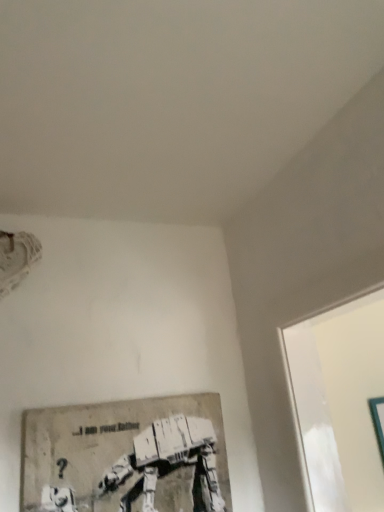
In order to click on teal glossy picture frame at right, which appears as the 1th picture frame when viewed from the back in this screenshot , I will do `click(378, 421)`.

What do you see at coordinates (378, 421) in the screenshot?
I see `teal glossy picture frame at right, arranged as the second picture frame when viewed from the left` at bounding box center [378, 421].

What do you see at coordinates (126, 457) in the screenshot?
I see `matte gray poster at lower left, acting as the 2th picture frame starting from the right` at bounding box center [126, 457].

Where is `matte gray poster at lower left, positioned as the second picture frame in back-to-front order`? This screenshot has height=512, width=384. matte gray poster at lower left, positioned as the second picture frame in back-to-front order is located at coordinates pyautogui.click(x=126, y=457).

Find the location of a particular element. The height and width of the screenshot is (512, 384). teal glossy picture frame at right, the second picture frame viewed from the front is located at coordinates (378, 421).

Visually, is teal glossy picture frame at right, arranged as the second picture frame when viewed from the left, positioned to the left or to the right of matte gray poster at lower left, which is counted as the first picture frame, starting from the front?

teal glossy picture frame at right, arranged as the second picture frame when viewed from the left, is positioned on matte gray poster at lower left, which is counted as the first picture frame, starting from the front,'s right side.

Is teal glossy picture frame at right, arranged as the second picture frame when viewed from the left, in front of or behind matte gray poster at lower left, which ranks as the first picture frame in left-to-right order, in the image?

In the image, teal glossy picture frame at right, arranged as the second picture frame when viewed from the left, appears behind matte gray poster at lower left, which ranks as the first picture frame in left-to-right order.

Which point is more distant from viewer, (382, 433) or (71, 426)?

The point (382, 433) is more distant.

From the image's perspective, between teal glossy picture frame at right, the second picture frame viewed from the front, and matte gray poster at lower left, positioned as the second picture frame in back-to-front order, which one is located above?

matte gray poster at lower left, positioned as the second picture frame in back-to-front order, is shown above in the image.

From a real-world perspective, which object stands above the other?

In real-world perspective, matte gray poster at lower left, acting as the 2th picture frame starting from the right, is above.

Which object is wider, teal glossy picture frame at right, the second picture frame viewed from the front, or matte gray poster at lower left, acting as the 2th picture frame starting from the right?

matte gray poster at lower left, acting as the 2th picture frame starting from the right.

Who is shorter, teal glossy picture frame at right, positioned as the first picture frame in right-to-left order, or matte gray poster at lower left, which is counted as the first picture frame, starting from the front?

matte gray poster at lower left, which is counted as the first picture frame, starting from the front.

Between teal glossy picture frame at right, the second picture frame viewed from the front, and matte gray poster at lower left, which ranks as the first picture frame in left-to-right order, which one has smaller size?

teal glossy picture frame at right, the second picture frame viewed from the front.

Is matte gray poster at lower left, which is counted as the first picture frame, starting from the front, surrounded by teal glossy picture frame at right, arranged as the second picture frame when viewed from the left?

Actually, matte gray poster at lower left, which is counted as the first picture frame, starting from the front, is outside teal glossy picture frame at right, arranged as the second picture frame when viewed from the left.

In the scene shown: Is teal glossy picture frame at right, which appears as the 1th picture frame when viewed from the back, positioned far away from matte gray poster at lower left, which is counted as the first picture frame, starting from the front?

teal glossy picture frame at right, which appears as the 1th picture frame when viewed from the back, is actually quite close to matte gray poster at lower left, which is counted as the first picture frame, starting from the front.

Could you tell me if teal glossy picture frame at right, positioned as the first picture frame in right-to-left order, is turned towards matte gray poster at lower left, positioned as the second picture frame in back-to-front order?

No.

Can you tell me how much teal glossy picture frame at right, arranged as the second picture frame when viewed from the left, and matte gray poster at lower left, positioned as the second picture frame in back-to-front order, differ in facing direction?

There is a 0.0492-degree angle between the facing directions of teal glossy picture frame at right, arranged as the second picture frame when viewed from the left, and matte gray poster at lower left, positioned as the second picture frame in back-to-front order.

How much distance is there between teal glossy picture frame at right, arranged as the second picture frame when viewed from the left, and matte gray poster at lower left, acting as the 2th picture frame starting from the right?

teal glossy picture frame at right, arranged as the second picture frame when viewed from the left, is 95.02 centimeters away from matte gray poster at lower left, acting as the 2th picture frame starting from the right.

Locate an element on the screen. The image size is (384, 512). picture frame on the right of matte gray poster at lower left, positioned as the second picture frame in back-to-front order is located at coordinates (378, 421).

Which is more to the right, matte gray poster at lower left, positioned as the second picture frame in back-to-front order, or teal glossy picture frame at right, arranged as the second picture frame when viewed from the left?

From the viewer's perspective, teal glossy picture frame at right, arranged as the second picture frame when viewed from the left, appears more on the right side.

Which object is closer to the camera, matte gray poster at lower left, acting as the 2th picture frame starting from the right, or teal glossy picture frame at right, arranged as the second picture frame when viewed from the left?

matte gray poster at lower left, acting as the 2th picture frame starting from the right, is closer to the camera.

Considering the positions of point (116, 508) and point (377, 439), is point (116, 508) closer or farther from the camera than point (377, 439)?

Point (116, 508) is closer to the camera than point (377, 439).

From the image's perspective, between matte gray poster at lower left, which is counted as the first picture frame, starting from the front, and teal glossy picture frame at right, arranged as the second picture frame when viewed from the left, which one is located above?

matte gray poster at lower left, which is counted as the first picture frame, starting from the front, appears higher in the image.

From a real-world perspective, is matte gray poster at lower left, which ranks as the first picture frame in left-to-right order, physically below teal glossy picture frame at right, arranged as the second picture frame when viewed from the left?

No, from a real-world perspective, matte gray poster at lower left, which ranks as the first picture frame in left-to-right order, is not below teal glossy picture frame at right, arranged as the second picture frame when viewed from the left.

Which object is thinner, matte gray poster at lower left, which ranks as the first picture frame in left-to-right order, or teal glossy picture frame at right, arranged as the second picture frame when viewed from the left?

With smaller width is teal glossy picture frame at right, arranged as the second picture frame when viewed from the left.

Which of these two, matte gray poster at lower left, acting as the 2th picture frame starting from the right, or teal glossy picture frame at right, which appears as the 1th picture frame when viewed from the back, stands shorter?

matte gray poster at lower left, acting as the 2th picture frame starting from the right, is shorter.

Who is smaller, matte gray poster at lower left, which ranks as the first picture frame in left-to-right order, or teal glossy picture frame at right, positioned as the first picture frame in right-to-left order?

teal glossy picture frame at right, positioned as the first picture frame in right-to-left order.

Is teal glossy picture frame at right, which appears as the 1th picture frame when viewed from the back, surrounded by matte gray poster at lower left, which ranks as the first picture frame in left-to-right order?

No, teal glossy picture frame at right, which appears as the 1th picture frame when viewed from the back, is located outside of matte gray poster at lower left, which ranks as the first picture frame in left-to-right order.

Is matte gray poster at lower left, acting as the 2th picture frame starting from the right, far from teal glossy picture frame at right, positioned as the first picture frame in right-to-left order?

matte gray poster at lower left, acting as the 2th picture frame starting from the right, is actually quite close to teal glossy picture frame at right, positioned as the first picture frame in right-to-left order.

Is matte gray poster at lower left, acting as the 2th picture frame starting from the right, positioned with its back to teal glossy picture frame at right, the second picture frame viewed from the front?

matte gray poster at lower left, acting as the 2th picture frame starting from the right, is not turned away from teal glossy picture frame at right, the second picture frame viewed from the front.

How many degrees apart are the facing directions of matte gray poster at lower left, acting as the 2th picture frame starting from the right, and teal glossy picture frame at right, arranged as the second picture frame when viewed from the left?

There is a 0.0492-degree angle between the facing directions of matte gray poster at lower left, acting as the 2th picture frame starting from the right, and teal glossy picture frame at right, arranged as the second picture frame when viewed from the left.

Could you measure the distance between matte gray poster at lower left, which is counted as the first picture frame, starting from the front, and teal glossy picture frame at right, arranged as the second picture frame when viewed from the left?

matte gray poster at lower left, which is counted as the first picture frame, starting from the front, is 37.41 inches from teal glossy picture frame at right, arranged as the second picture frame when viewed from the left.

This screenshot has width=384, height=512. In order to click on picture frame above the teal glossy picture frame at right, arranged as the second picture frame when viewed from the left (from the image's perspective) in this screenshot , I will do `click(126, 457)`.

Identify the location of picture frame that appears behind the matte gray poster at lower left, acting as the 2th picture frame starting from the right. (378, 421).

Find the location of a particular element. picture frame that appears on the left of teal glossy picture frame at right, the second picture frame viewed from the front is located at coordinates (126, 457).